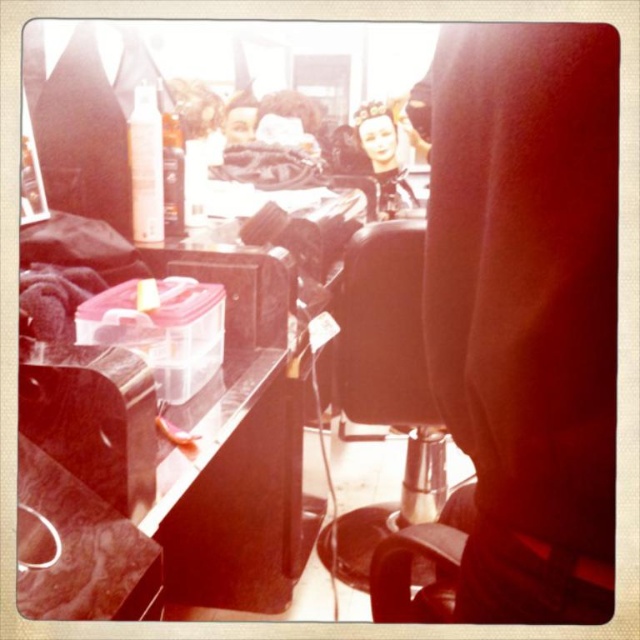
You are a customer in the salon and want to know which of the two points, point [413,416] or point [426,148], is closer to you. Can you determine this based on your position in the scene?

Point [413,416] is closer to the viewer than point [426,148], so the customer should choose point [413,416] as the closer one.

You are a customer in a hair salon and want to sit down. There is a black leather swivel chair at center and a smooth porcelain doll at center. Which object should you sit on?

The black leather swivel chair at center is positioned on the left side of smooth porcelain doll at center. You should sit on the black leather swivel chair at center because it is designed for seating, while the smooth porcelain doll at center is likely a decorative item and not meant for sitting.

You are a delivery person who needs to place a large box between the black leather barber chair at center and the smooth porcelain doll at center. The box requires a space of 1.5 meters. Can you fit the box between them?

The distance between the black leather barber chair at center and the smooth porcelain doll at center is 1.64 meters, which is sufficient to fit the box requiring 1.5 meters of space.